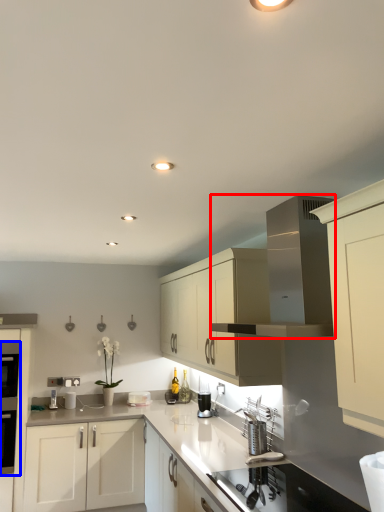
Question: Among these objects, which one is farthest to the camera, vent (highlighted by a red box) or oven (highlighted by a blue box)?

Choices:
 (A) vent
 (B) oven

Answer: (B)